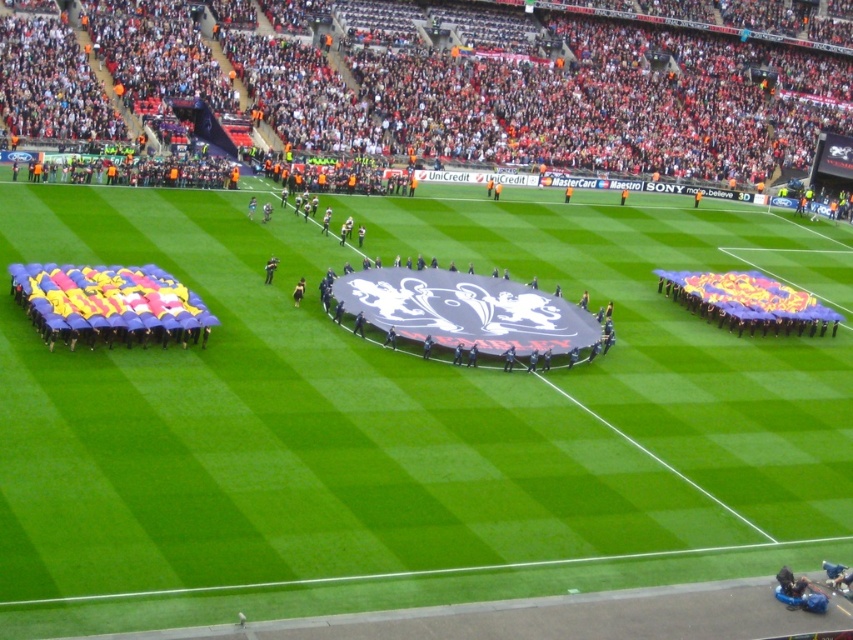
Question: Can you confirm if green grass football field at center is wider than red fabric crowd at upper center?

Choices:
 (A) no
 (B) yes

Answer: (A)

Question: Among these objects, which one is farthest from the camera?

Choices:
 (A) green grass football field at center
 (B) red fabric crowd at upper center

Answer: (B)

Question: Is green grass football field at center thinner than red fabric crowd at upper center?

Choices:
 (A) yes
 (B) no

Answer: (A)

Question: Can you confirm if green grass football field at center is thinner than red fabric crowd at upper center?

Choices:
 (A) yes
 (B) no

Answer: (A)